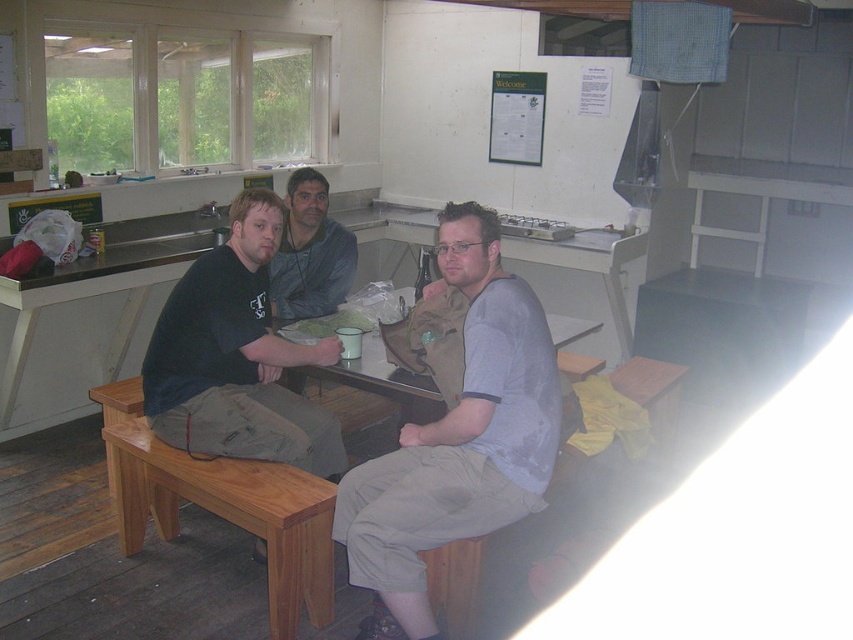
Is light brown wood bench at lower left below matte gray jacket at center?

Correct, light brown wood bench at lower left is located below matte gray jacket at center.

Is point (108, 385) behind point (296, 193)?

No, (108, 385) is closer to viewer.

The width and height of the screenshot is (853, 640). Find the location of `light brown wood bench at lower left`. light brown wood bench at lower left is located at coordinates (222, 506).

Consider the image. Can you confirm if gray cotton shirt at center is positioned above matte gray jacket at center?

Incorrect, gray cotton shirt at center is not positioned above matte gray jacket at center.

Is point (461, 496) positioned after point (281, 280)?

No, (461, 496) is in front of (281, 280).

What are the coordinates of `gray cotton shirt at center` in the screenshot? It's located at (459, 433).

Who is taller, gray cotton shirt at center or light brown wood bench at lower left?

gray cotton shirt at center

Does point (471, 388) come farther from viewer compared to point (190, 499)?

No, (471, 388) is in front of (190, 499).

The image size is (853, 640). Identify the location of gray cotton shirt at center. tap(459, 433).